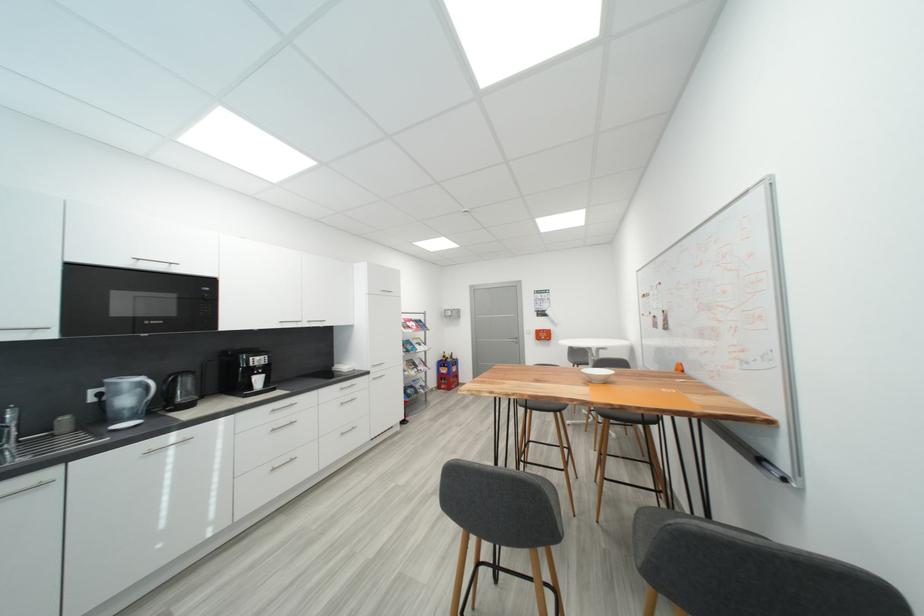
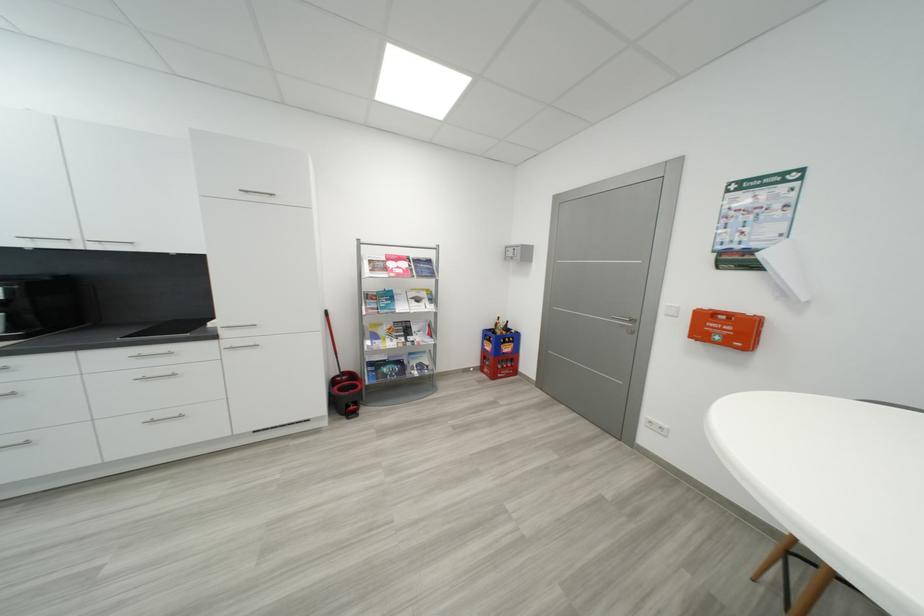
The point at [551,338] is marked in the first image. Where is the corresponding point in the second image?

(733, 333)